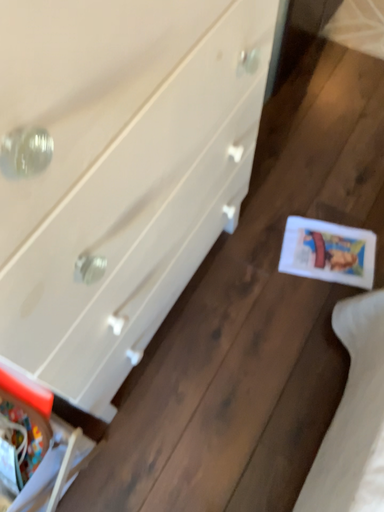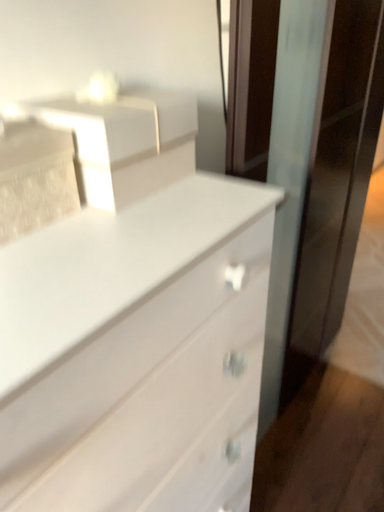
Question: Which way did the camera rotate in the video?

Choices:
 (A) rotated downward
 (B) rotated upward

Answer: (B)